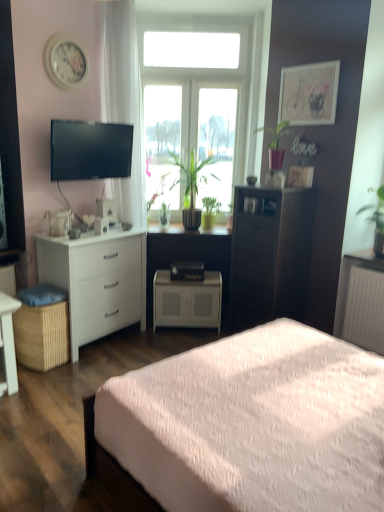
Question: From the image's perspective, is white glossy desk at lower left positioned above or below white matte cabinet at center?

Choices:
 (A) above
 (B) below

Answer: (B)

Question: Considering the positions of white glossy desk at lower left and white matte cabinet at center in the image, is white glossy desk at lower left wider or thinner than white matte cabinet at center?

Choices:
 (A) wide
 (B) thin

Answer: (B)

Question: Which object is the closest to the green glossy plant at upper right, acting as the 1th houseplant starting from the right?

Choices:
 (A) white matte cabinet at center, which appears as the 2th chest of drawers when viewed from the right
 (B) white glossy coffee cup at left
 (C) transparent glass window at center
 (D) green matte plant at center, marked as the second houseplant in a left-to-right arrangement
 (E) white matte cabinet at center

Answer: (D)

Question: Which object is positioned farthest from the white quilted bed at center?

Choices:
 (A) brown woven picnic basket at lower left
 (B) white glossy coffee cup at left
 (C) dark wood cabinet at center, the 3th chest of drawers when ordered from left to right
 (D) matte black tv at upper left
 (E) green matte plant at center, placed as the fifth houseplant when sorted from right to left

Answer: (E)